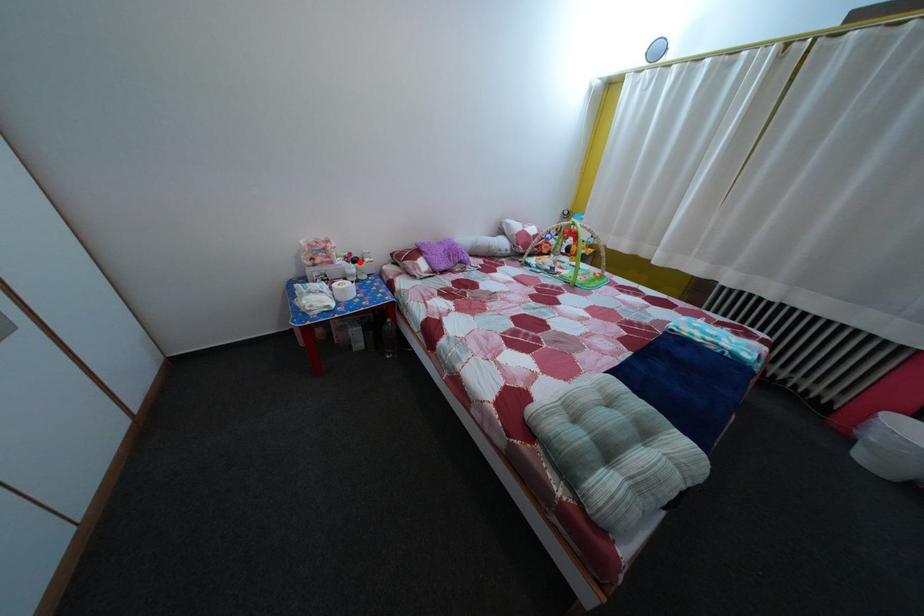
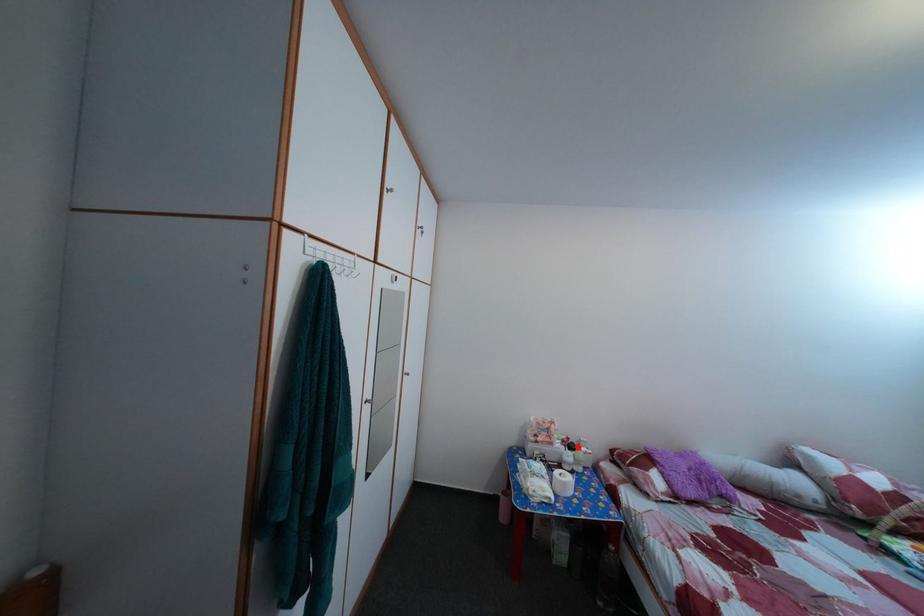
I am providing you with two images of the same scene from different viewpoints. A red point is marked on the first image and another point is marked on the second image. Do the highlighted points in image1 and image2 indicate the same real-world spot?

Yes